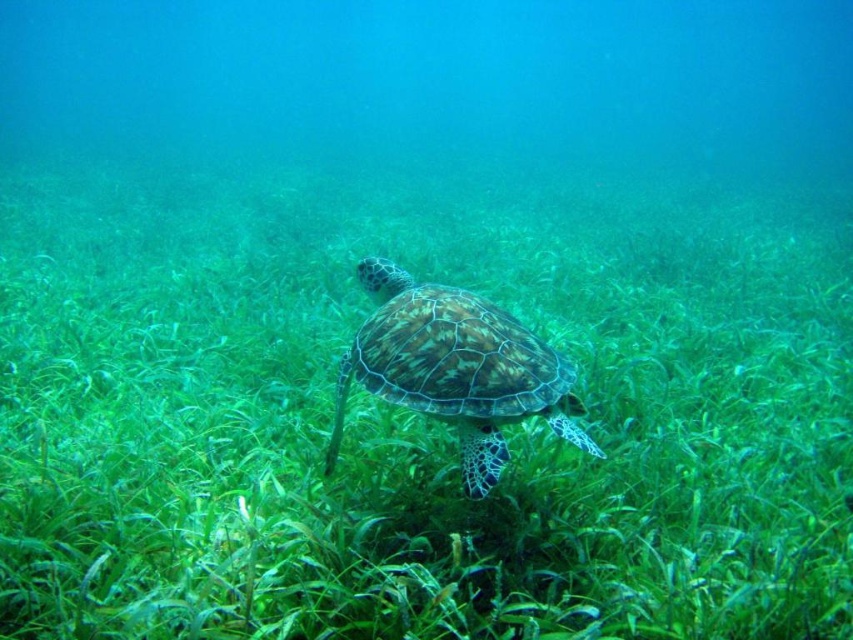
You are a marine biologist observing an underwater scene. You notice the green leafy grass at center and the green textured shell at center. Which object is wider in this scene?

The green leafy grass at center is wider than the green textured shell at center according to the description.

You are a marine biologist observing an underwater scene. You notice the green leafy grass at center and the green textured shell at center. Which object is located higher in the water column?

The green leafy grass at center is above the green textured shell at center, so it is higher in the water column.

In the scene shown: You are a marine biologist observing this underwater scene. You need to place a 1.5 meter long measuring tape between the green leafy grass at center and the green textured shell at center. Will the entire measuring tape fit between them?

The distance between the green leafy grass at center and the green textured shell at center is 1.48 meters. Since the measuring tape is 1.5 meters long, it will be slightly too long to fit entirely between them.